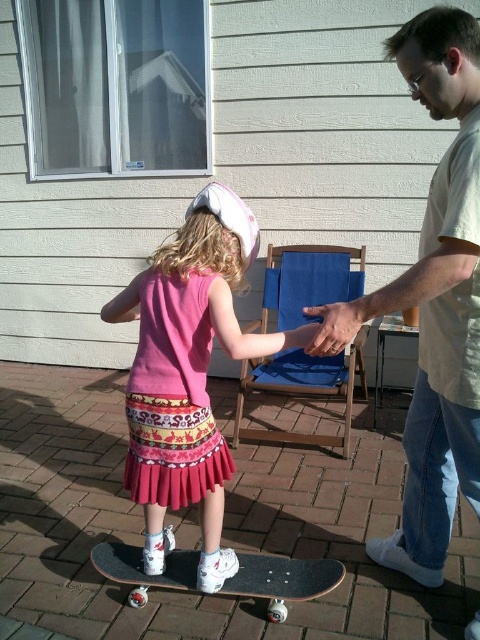
Question: Is pink fabric skirt at center below smooth skin hand at center?

Choices:
 (A) yes
 (B) no

Answer: (A)

Question: Which point is closer to the camera taking this photo?

Choices:
 (A) pyautogui.click(x=236, y=264)
 (B) pyautogui.click(x=349, y=304)

Answer: (B)

Question: Estimate the real-world distances between objects in this image. Which object is closer to the wooden skateboard at center?

Choices:
 (A) light beige shirt at right
 (B) smooth skin hand at center
 (C) pink fabric skirt at center

Answer: (C)

Question: Where is pink fabric skirt at center located in relation to smooth skin hand at center in the image?

Choices:
 (A) right
 (B) left

Answer: (B)

Question: Which object is the closest to the smooth skin hand at center?

Choices:
 (A) light beige shirt at right
 (B) wooden skateboard at center

Answer: (A)

Question: Does pink fabric skirt at center have a smaller size compared to smooth skin hand at center?

Choices:
 (A) no
 (B) yes

Answer: (A)